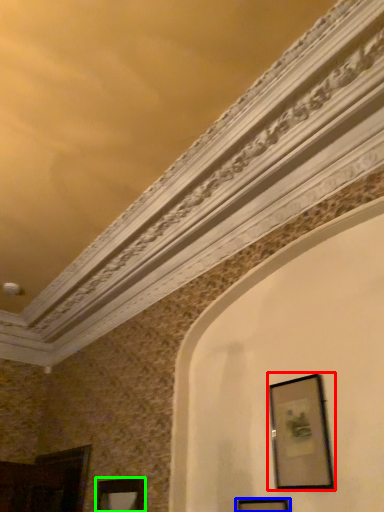
Question: Which object is the farthest from picture frame (highlighted by a red box)? Choose among these: picture frame (highlighted by a blue box) or picture frame (highlighted by a green box).

Choices:
 (A) picture frame
 (B) picture frame

Answer: (B)